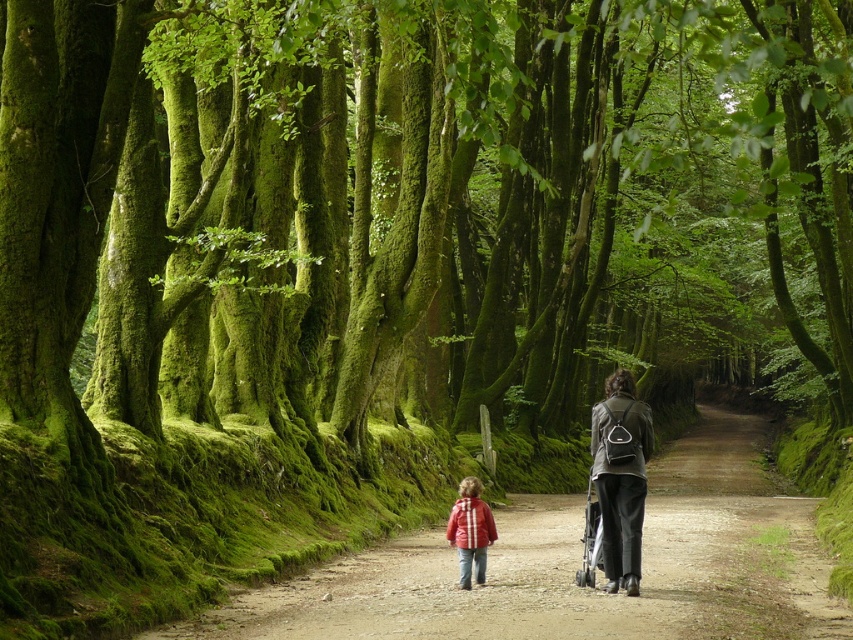
You are standing at the point marked by the coordinates point (x=619, y=477). Which object are you standing on?

The point (x=619, y=477) is on the matte black backpack at center.

You are standing at the starting point of the dirt path at center and want to reach the red plaid jacket at center. Which direction should you walk to get there?

The dirt path at center is to the right of the red plaid jacket at center, so you should walk to the left to reach the red plaid jacket at center.